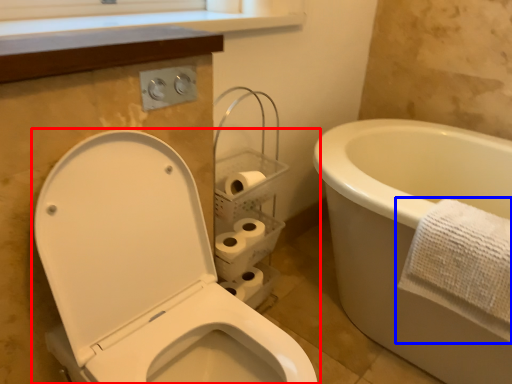
Question: Which object appears closest to the camera in this image, toilet (highlighted by a red box) or towel (highlighted by a blue box)?

Choices:
 (A) toilet
 (B) towel

Answer: (A)